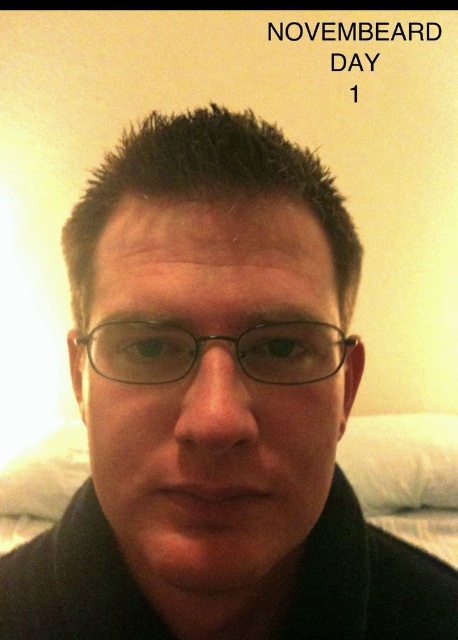
Question: Does matte black glasses at center have a greater width compared to black plastic glasses at center?

Choices:
 (A) no
 (B) yes

Answer: (B)

Question: Which point is farther to the camera?

Choices:
 (A) (187, 371)
 (B) (233, 413)

Answer: (A)

Question: Is matte black glasses at center above black plastic glasses at center?

Choices:
 (A) yes
 (B) no

Answer: (B)

Question: Is matte black glasses at center wider than black plastic glasses at center?

Choices:
 (A) yes
 (B) no

Answer: (A)